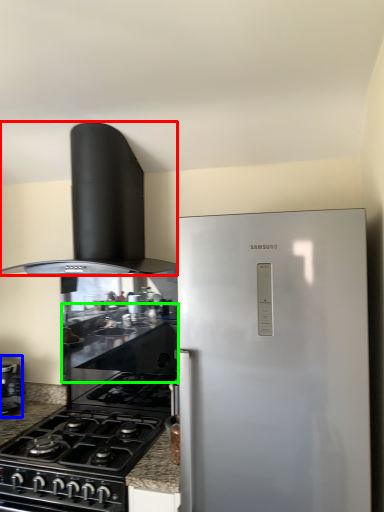
Question: Based on their relative distances, which object is nearer to home appliance (highlighted by a red box)? Choose from kitchen appliance (highlighted by a blue box) and counter top (highlighted by a green box).

Choices:
 (A) kitchen appliance
 (B) counter top

Answer: (B)